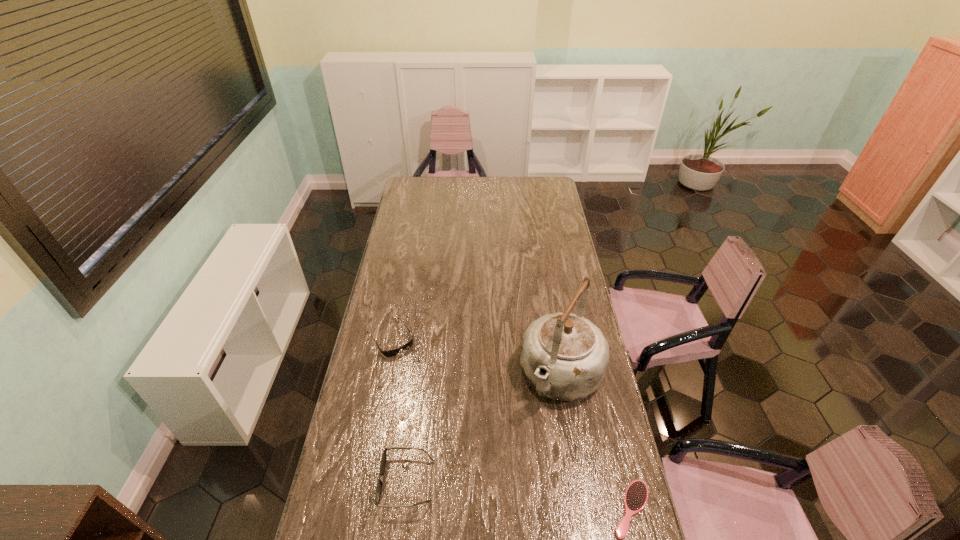
Identify the location of free space at the left edge. The height and width of the screenshot is (540, 960). (417, 254).

In the image, there is a desktop. Identify the location of vacant space at the right edge. The image size is (960, 540). pyautogui.click(x=565, y=241).

The image size is (960, 540). What are the coordinates of `empty location between the shortest object and the nearer sunglasses` in the screenshot? It's located at (519, 495).

Locate an element on the screen. This screenshot has width=960, height=540. free space between the tallest object and the farther sunglasses is located at coordinates (476, 356).

At what (x,y) coordinates should I click in order to perform the action: click on vacant area that lies between the tallest object and the hairbrush. Please return your answer as a coordinate pair (x, y). Looking at the image, I should click on (596, 442).

At what (x,y) coordinates should I click in order to perform the action: click on free area in between the kettle and the nearer sunglasses. Please return your answer as a coordinate pair (x, y). Looking at the image, I should click on (484, 428).

The width and height of the screenshot is (960, 540). In order to click on free area in between the farther sunglasses and the nearer sunglasses in this screenshot , I will do `click(398, 409)`.

Where is `vacant space that is in between the shortest object and the tallest object`? The image size is (960, 540). vacant space that is in between the shortest object and the tallest object is located at coordinates (596, 442).

Where is `vacant region between the hairbrush and the kettle`? This screenshot has height=540, width=960. vacant region between the hairbrush and the kettle is located at coordinates (596, 442).

At what (x,y) coordinates should I click in order to perform the action: click on vacant area between the hairbrush and the farther sunglasses. Please return your answer as a coordinate pair (x, y). The width and height of the screenshot is (960, 540). Looking at the image, I should click on (511, 423).